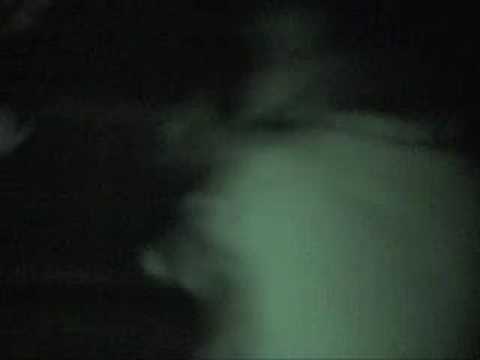
The height and width of the screenshot is (360, 480). I want to click on light, so click(x=339, y=169).